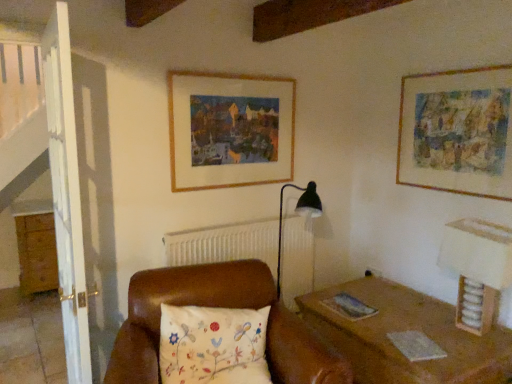
What do you see at coordinates (232, 128) in the screenshot?
I see `wooden frame at upper center, placed as the second picture frame when sorted from right to left` at bounding box center [232, 128].

Locate an element on the screen. watercolor paper painting at upper right, acting as the 2th picture frame starting from the left is located at coordinates (457, 132).

Where is `wooden table lamp at right`? wooden table lamp at right is located at coordinates (477, 269).

Can you confirm if floral-patterned fabric pillow at center is positioned to the right of wooden dresser at left?

Correct, you'll find floral-patterned fabric pillow at center to the right of wooden dresser at left.

In the image, is floral-patterned fabric pillow at center positioned in front of or behind wooden dresser at left?

floral-patterned fabric pillow at center is positioned closer to the viewer than wooden dresser at left.

Does floral-patterned fabric pillow at center have a smaller size compared to wooden dresser at left?

Indeed, floral-patterned fabric pillow at center has a smaller size compared to wooden dresser at left.

Between watercolor paper painting at upper right, acting as the 2th picture frame starting from the left, and wooden table lamp at right, which one has larger size?

wooden table lamp at right.

Considering the sizes of objects watercolor paper painting at upper right, the 1th picture frame positioned from the right, and wooden table lamp at right in the image provided, who is wider, watercolor paper painting at upper right, the 1th picture frame positioned from the right, or wooden table lamp at right?

Wider between the two is wooden table lamp at right.

Can you tell me how much watercolor paper painting at upper right, acting as the 2th picture frame starting from the left, and wooden table lamp at right differ in facing direction?

0.602 degrees.

Considering the points (425, 116) and (470, 220), which point is in front, point (425, 116) or point (470, 220)?

The point (470, 220) is in front.

How different are the orientations of wooden dresser at left and wooden table lamp at right in degrees?

There is a 90.4-degree angle between the facing directions of wooden dresser at left and wooden table lamp at right.

Looking at this image, could you tell me if wooden dresser at left is facing wooden table lamp at right?

No, wooden dresser at left is not turned towards wooden table lamp at right.

From a real-world perspective, is wooden dresser at left located higher than wooden table lamp at right?

Actually, wooden dresser at left is physically below wooden table lamp at right in the real world.

Is wooden dresser at left to the right of wooden table lamp at right from the viewer's perspective?

No.

Is wooden dresser at left facing towards wooden frame at upper center, positioned as the first picture frame in left-to-right order?

No, wooden dresser at left is not aimed at wooden frame at upper center, positioned as the first picture frame in left-to-right order.

Based on their positions, is wooden dresser at left located to the left or right of wooden frame at upper center, positioned as the first picture frame in left-to-right order?

Clearly, wooden dresser at left is on the left of wooden frame at upper center, positioned as the first picture frame in left-to-right order, in the image.

Is wooden dresser at left not close to wooden frame at upper center, positioned as the first picture frame in left-to-right order?

wooden dresser at left is far away from wooden frame at upper center, positioned as the first picture frame in left-to-right order.

Who is smaller, wooden dresser at left or wooden frame at upper center, placed as the second picture frame when sorted from right to left?

With smaller size is wooden frame at upper center, placed as the second picture frame when sorted from right to left.

Locate an element on the screen. The image size is (512, 384). table lamp on the right side of watercolor paper painting at upper right, acting as the 2th picture frame starting from the left is located at coordinates (477, 269).

From a real-world perspective, relative to watercolor paper painting at upper right, acting as the 2th picture frame starting from the left, is wooden table lamp at right vertically above or below?

Clearly, from a real-world perspective, wooden table lamp at right is below watercolor paper painting at upper right, acting as the 2th picture frame starting from the left.

Is wooden table lamp at right inside the boundaries of watercolor paper painting at upper right, the 1th picture frame positioned from the right, or outside?

wooden table lamp at right lies outside watercolor paper painting at upper right, the 1th picture frame positioned from the right.

Is wooden table lamp at right beside watercolor paper painting at upper right, acting as the 2th picture frame starting from the left?

wooden table lamp at right is not next to watercolor paper painting at upper right, acting as the 2th picture frame starting from the left, and they're not touching.

Can you tell me how much watercolor paper painting at upper right, acting as the 2th picture frame starting from the left, and wooden dresser at left differ in facing direction?

watercolor paper painting at upper right, acting as the 2th picture frame starting from the left, and wooden dresser at left are facing 89.8 degrees away from each other.

Is watercolor paper painting at upper right, the 1th picture frame positioned from the right, situated inside wooden dresser at left or outside?

watercolor paper painting at upper right, the 1th picture frame positioned from the right, exists outside the volume of wooden dresser at left.

Is watercolor paper painting at upper right, the 1th picture frame positioned from the right, positioned with its back to wooden dresser at left?

No, watercolor paper painting at upper right, the 1th picture frame positioned from the right,'s orientation is not away from wooden dresser at left.

Considering the sizes of objects watercolor paper painting at upper right, the 1th picture frame positioned from the right, and wooden dresser at left in the image provided, who is wider, watercolor paper painting at upper right, the 1th picture frame positioned from the right, or wooden dresser at left?

Wider between the two is wooden dresser at left.

Considering their positions, is wooden frame at upper center, placed as the second picture frame when sorted from right to left, located in front of or behind floral-patterned fabric pillow at center?

wooden frame at upper center, placed as the second picture frame when sorted from right to left, is behind floral-patterned fabric pillow at center.

Based on the photo, from a real-world perspective, is wooden frame at upper center, placed as the second picture frame when sorted from right to left, physically above floral-patterned fabric pillow at center?

Indeed, from a real-world perspective, wooden frame at upper center, placed as the second picture frame when sorted from right to left, stands above floral-patterned fabric pillow at center.

Considering the sizes of objects wooden frame at upper center, placed as the second picture frame when sorted from right to left, and floral-patterned fabric pillow at center in the image provided, who is thinner, wooden frame at upper center, placed as the second picture frame when sorted from right to left, or floral-patterned fabric pillow at center?

wooden frame at upper center, placed as the second picture frame when sorted from right to left.

The height and width of the screenshot is (384, 512). I want to click on pillow that appears below the wooden dresser at left (from the image's perspective), so click(x=213, y=345).

You are a GUI agent. You are given a task and a screenshot of the screen. Output one action in this format:
    pyautogui.click(x=<x>, y=<y>)
    Task: Click on the table lamp that is on the right side of watercolor paper painting at upper right, the 1th picture frame positioned from the right
    
    Given the screenshot: What is the action you would take?
    pyautogui.click(x=477, y=269)

Considering their positions, is wooden frame at upper center, placed as the second picture frame when sorted from right to left, positioned further to floral-patterned fabric pillow at center than watercolor paper painting at upper right, the 1th picture frame positioned from the right?

watercolor paper painting at upper right, the 1th picture frame positioned from the right, is further to floral-patterned fabric pillow at center.

Looking at the image, which one is located further to wooden frame at upper center, placed as the second picture frame when sorted from right to left, wooden table lamp at right or watercolor paper painting at upper right, the 1th picture frame positioned from the right?

wooden table lamp at right lies further to wooden frame at upper center, placed as the second picture frame when sorted from right to left, than the other object.

From the picture: Which object lies further to the anchor point floral-patterned fabric pillow at center, watercolor paper painting at upper right, the 1th picture frame positioned from the right, or wooden dresser at left?

The object further to floral-patterned fabric pillow at center is wooden dresser at left.

Which object lies nearer to the anchor point wooden frame at upper center, placed as the second picture frame when sorted from right to left, wooden dresser at left or wooden table lamp at right?

Among the two, wooden table lamp at right is located nearer to wooden frame at upper center, placed as the second picture frame when sorted from right to left.

Based on their spatial positions, is wooden dresser at left or watercolor paper painting at upper right, acting as the 2th picture frame starting from the left, further from floral-patterned fabric pillow at center?

wooden dresser at left lies further to floral-patterned fabric pillow at center than the other object.

When comparing their distances from wooden dresser at left, does floral-patterned fabric pillow at center or watercolor paper painting at upper right, acting as the 2th picture frame starting from the left, seem further?

Among the two, watercolor paper painting at upper right, acting as the 2th picture frame starting from the left, is located further to wooden dresser at left.

Looking at the image, which one is located further to wooden table lamp at right, floral-patterned fabric pillow at center or wooden dresser at left?

The object further to wooden table lamp at right is wooden dresser at left.

Based on the photo, from the image, which object appears to be nearer to wooden dresser at left, wooden table lamp at right or watercolor paper painting at upper right, acting as the 2th picture frame starting from the left?

watercolor paper painting at upper right, acting as the 2th picture frame starting from the left, lies closer to wooden dresser at left than the other object.

Locate an element on the screen. The height and width of the screenshot is (384, 512). picture frame between wooden dresser at left and watercolor paper painting at upper right, the 1th picture frame positioned from the right, in the horizontal direction is located at coordinates (232, 128).

The image size is (512, 384). Identify the location of picture frame between floral-patterned fabric pillow at center and watercolor paper painting at upper right, acting as the 2th picture frame starting from the left. (232, 128).

Locate an element on the screen. The height and width of the screenshot is (384, 512). pillow between wooden dresser at left and wooden frame at upper center, positioned as the first picture frame in left-to-right order, from left to right is located at coordinates (213, 345).

The width and height of the screenshot is (512, 384). I want to click on pillow situated between wooden dresser at left and watercolor paper painting at upper right, acting as the 2th picture frame starting from the left, from left to right, so click(x=213, y=345).